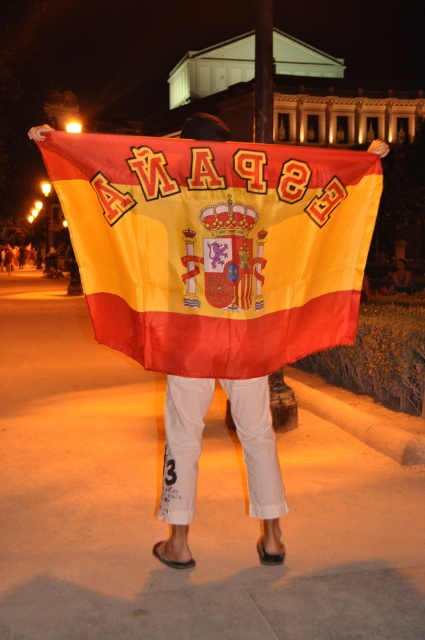
You are a stage designer setting up a parade float. The flag needs to be positioned so that the bottom edge of the flag is exactly 1.5 meters above the ground. Given the distance between the textured cotton flag at center and the brown wooden pole at upper center, can you determine if the pole is tall enough to hold the flag at the required height?

The distance between the textured cotton flag at center and the brown wooden pole at upper center is 2.97 meters. Since the flag needs to be 1.5 meters above the ground, the pole must be at least 1.5 meters tall. Since 2.97 meters is greater than 1.5 meters, the pole is tall enough to hold the flag at the required height.

You are a photographer standing in front of the textured cotton flag at center and the brown wooden pole at upper center. You want to capture both objects in a single frame. Which object should you focus on first to ensure both are in the frame?

The textured cotton flag at center has a lesser height compared to the brown wooden pole at upper center, so you should focus on the brown wooden pole at upper center first to ensure both are in the frame.

You are standing at the origin point in the image. A flag is located at point (215, 246). If you want to walk towards the flag, which direction should you move?

To reach the flag at point (215, 246) from the origin, you should move northeast since the flag is located northeast of the origin point.